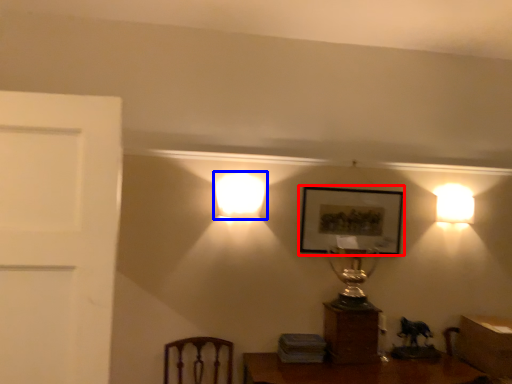
Question: Which object appears farthest to the camera in this image, picture frame (highlighted by a red box) or lamp (highlighted by a blue box)?

Choices:
 (A) picture frame
 (B) lamp

Answer: (A)